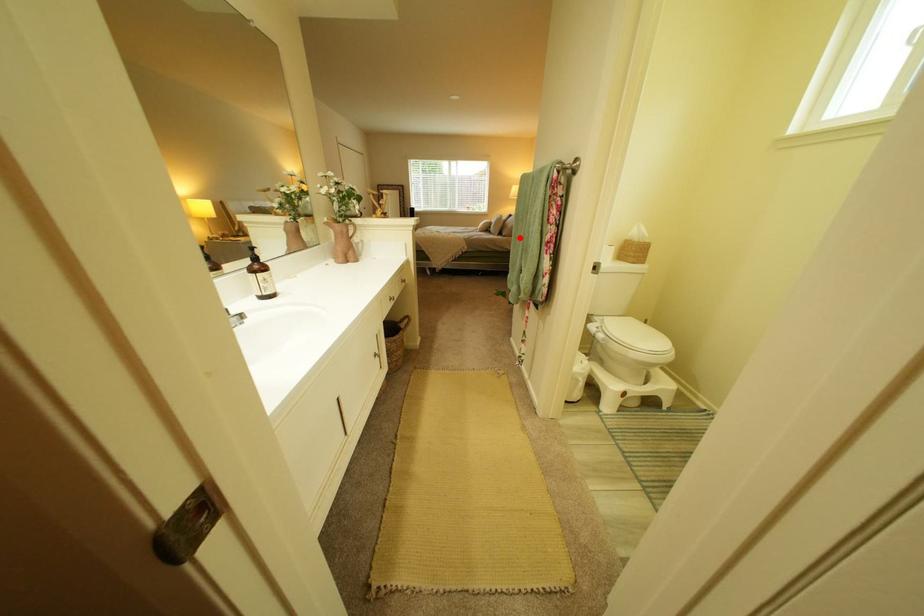
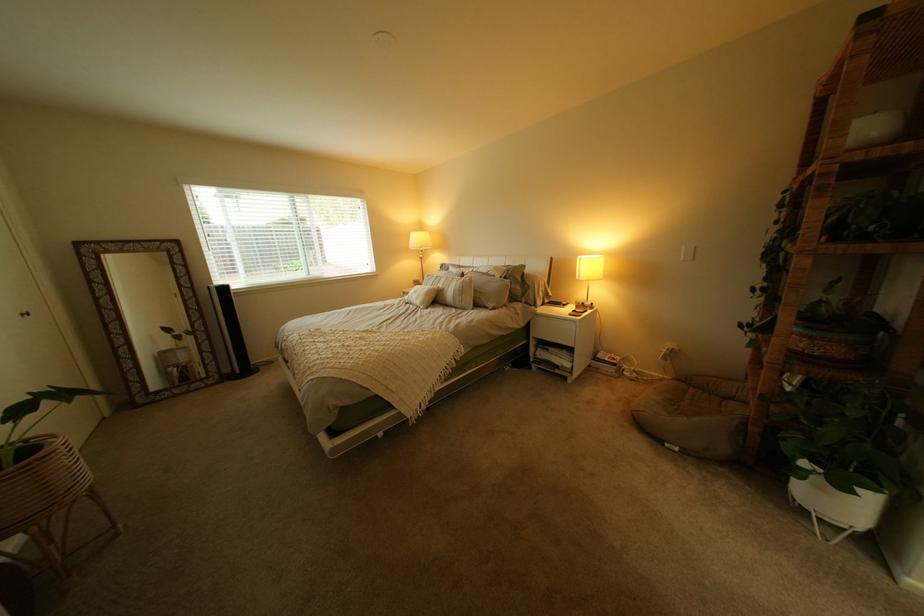
Question: I am providing you with two images of the same scene from different viewpoints. Image1 has a red point marked. In image2, the corresponding 3D location appears at what relative position? Reply with the corresponding letter.

Choices:
 (A) Closer
 (B) Farther

Answer: (B)